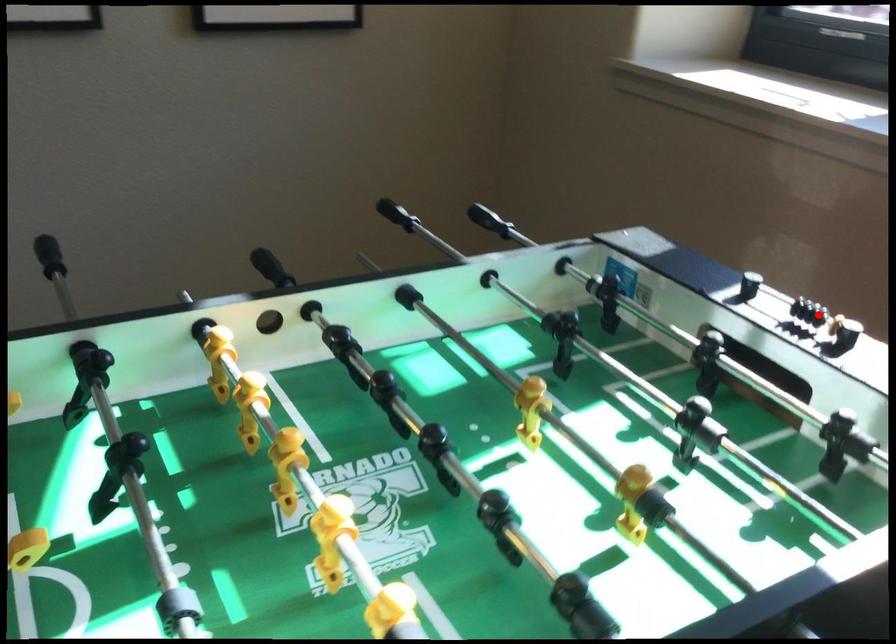
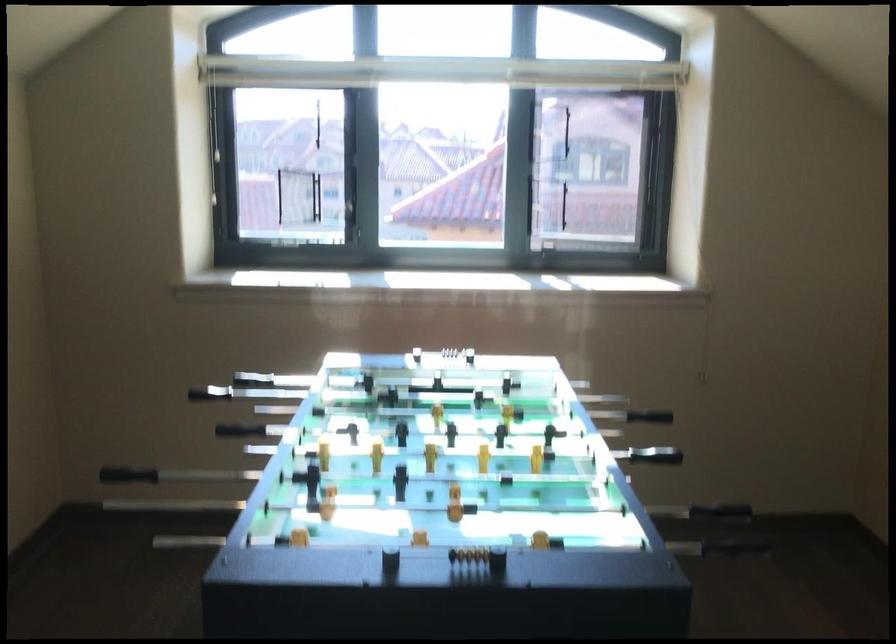
Question: I am providing you with two images of the same scene from different viewpoints. A red point is marked on the first image. At the location where the point appears in image 1, is it still visible in image 2?

Choices:
 (A) Yes
 (B) No

Answer: (A)